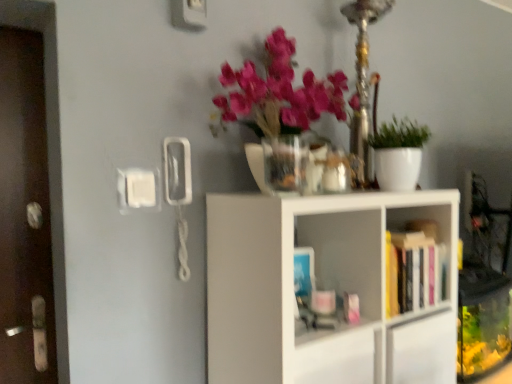
Question: Considering the positions of white matte plant pot at right and brown wooden door at left in the image, is white matte plant pot at right taller or shorter than brown wooden door at left?

Choices:
 (A) short
 (B) tall

Answer: (A)

Question: Considering the positions of white matte plant pot at right and brown wooden door at left in the image, is white matte plant pot at right bigger or smaller than brown wooden door at left?

Choices:
 (A) small
 (B) big

Answer: (A)

Question: Considering the real-world distances, which object is farthest from the translucent glass vase at upper center?

Choices:
 (A) brown wooden door at left
 (B) white matte plant pot at right
 (C) hardcover books at center right, positioned as the second shelf in bottom-to-top order
 (D) white matte shelf at center, which is the first shelf from bottom to top

Answer: (A)

Question: Estimate the real-world distances between objects in this image. Which object is farther from the brown wooden door at left?

Choices:
 (A) hardcover books at center right, positioned as the second shelf in bottom-to-top order
 (B) white matte plant pot at right
 (C) translucent glass vase at upper center
 (D) white matte shelf at center, which is the first shelf from bottom to top

Answer: (A)